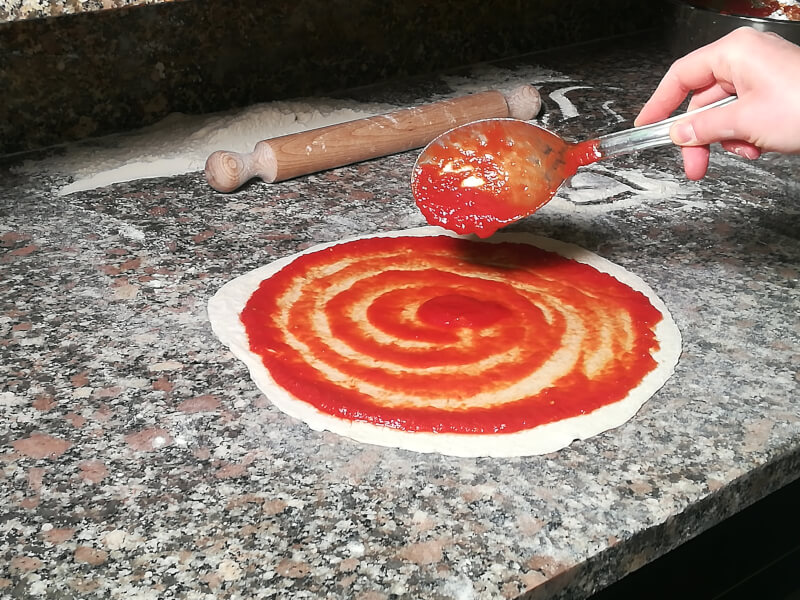
The image size is (800, 600). Identify the location of spoon. (609, 147).